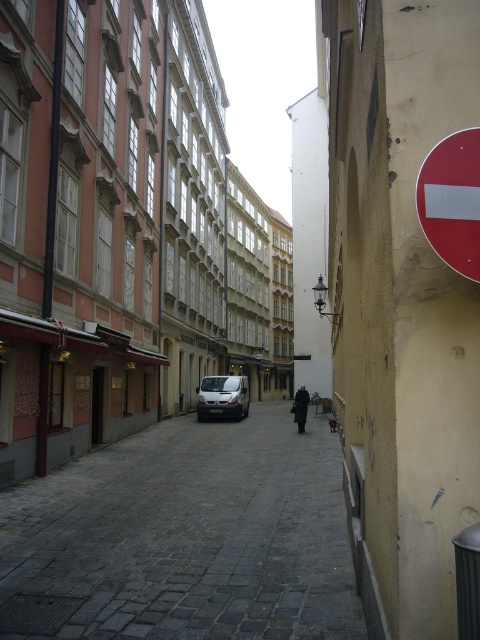
Is the position of gray cobblestone pavement at center less distant than that of silver metallic van at center?

Yes, it is.

Looking at this image, does gray cobblestone pavement at center have a greater height compared to silver metallic van at center?

Incorrect, gray cobblestone pavement at center's height is not larger of silver metallic van at center's.

I want to click on gray cobblestone pavement at center, so (189, 536).

This screenshot has width=480, height=640. Find the location of `gray cobblestone pavement at center`. gray cobblestone pavement at center is located at coordinates pos(189,536).

Does gray cobblestone pavement at center have a greater width compared to black metal pole at left?

Yes, gray cobblestone pavement at center is wider than black metal pole at left.

Can you confirm if gray cobblestone pavement at center is bigger than black metal pole at left?

Yes.

Locate an element on the screen. gray cobblestone pavement at center is located at coordinates (189, 536).

In order to click on gray cobblestone pavement at center in this screenshot , I will do pos(189,536).

Can you confirm if red matte sign at right is wider than silver metallic van at center?

Incorrect, red matte sign at right's width does not surpass silver metallic van at center's.

Who is taller, red matte sign at right or silver metallic van at center?

silver metallic van at center is taller.

Does point (452, 230) lie behind point (202, 412)?

No, (452, 230) is closer to viewer.

Find the location of `red matte sign at right`. red matte sign at right is located at coordinates (452, 200).